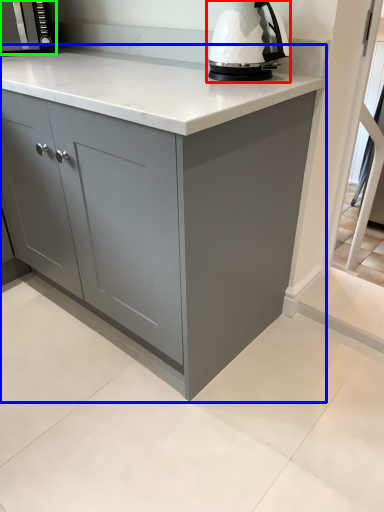
Question: Which object is the farthest from home appliance (highlighted by a red box)? Choose among these: cabinetry (highlighted by a blue box) or kitchen appliance (highlighted by a green box).

Choices:
 (A) cabinetry
 (B) kitchen appliance

Answer: (B)